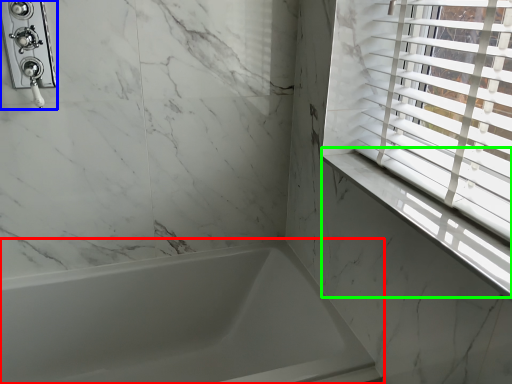
Question: Which is farther away from bathtub (highlighted by a red box)? shower (highlighted by a blue box) or window sill (highlighted by a green box)?

Choices:
 (A) shower
 (B) window sill

Answer: (A)